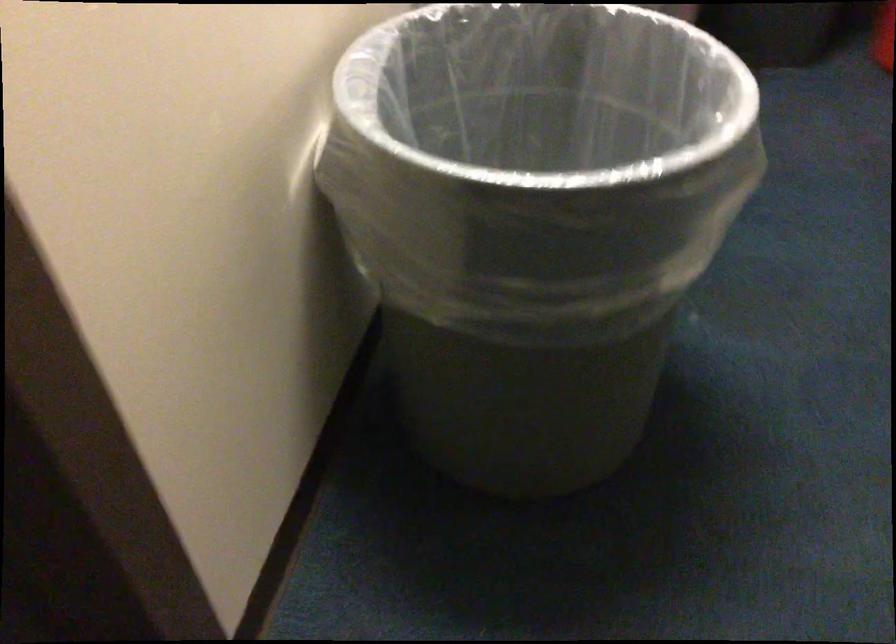
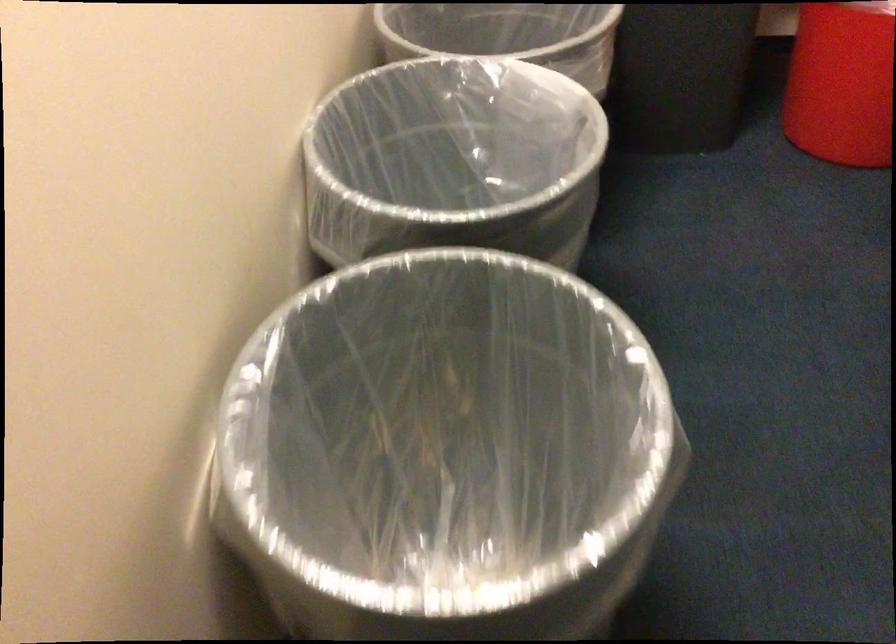
Which direction would the cameraman need to move to produce the second image?

The movement direction of the cameraman is right, forward.